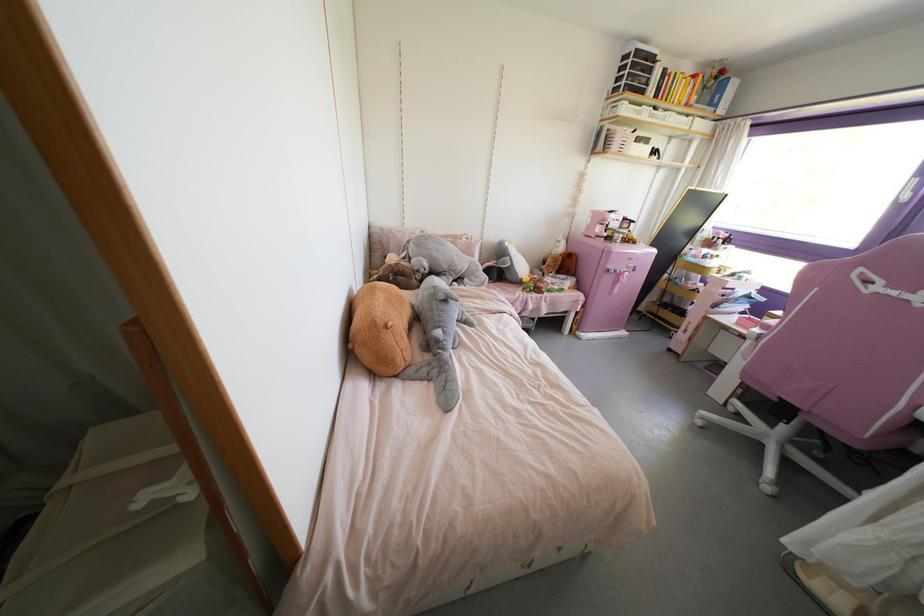
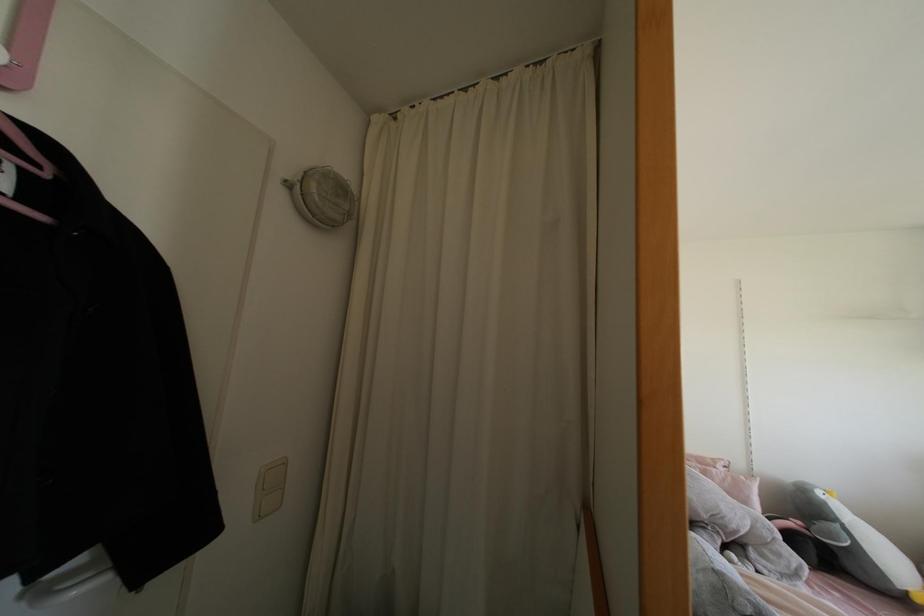
In the second image, find the point that corresponds to pixel 505 243 in the first image.

(819, 493)